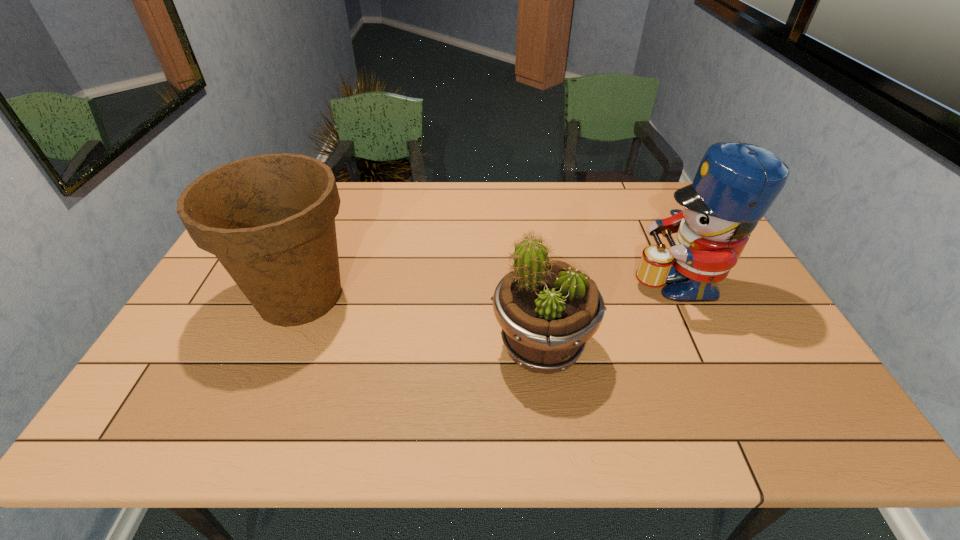
The width and height of the screenshot is (960, 540). Identify the location of empty location between the leftmost object and the second object from right to left. (420, 322).

You are a GUI agent. You are given a task and a screenshot of the screen. Output one action in this format:
    pyautogui.click(x=<x>, y=<y>)
    Task: Click on the vacant space in between the nutcracker and the leftmost object
    The height and width of the screenshot is (540, 960).
    Given the screenshot: What is the action you would take?
    (x=488, y=288)

Find the location of `vacant area that lies between the leftmost object and the nutcracker`. vacant area that lies between the leftmost object and the nutcracker is located at coordinates (488, 288).

This screenshot has width=960, height=540. Find the location of `vacant point located between the second object from left to right and the leftmost object`. vacant point located between the second object from left to right and the leftmost object is located at coordinates (420, 322).

Image resolution: width=960 pixels, height=540 pixels. What are the coordinates of `free spot between the second object from left to right and the tallest object` in the screenshot? It's located at (609, 313).

The width and height of the screenshot is (960, 540). I want to click on object identified as the second closest to the rightmost object, so click(x=269, y=219).

Identify the location of object identified as the second closest to the tallest object. The height and width of the screenshot is (540, 960). (269, 219).

Identify the location of free space that satisfies the following two spatial constraints: 1. on the front side of the left flowerpot; 2. on the left side of the second object from right to left. (278, 347).

At what (x,y) coordinates should I click in order to perform the action: click on vacant space that satisfies the following two spatial constraints: 1. on the front-facing side of the nutcracker; 2. on the front side of the left flowerpot. Please return your answer as a coordinate pair (x, y). Image resolution: width=960 pixels, height=540 pixels. Looking at the image, I should click on (683, 296).

At what (x,y) coordinates should I click in order to perform the action: click on vacant space that satisfies the following two spatial constraints: 1. on the front-facing side of the nutcracker; 2. on the front side of the right flowerpot. Please return your answer as a coordinate pair (x, y). Looking at the image, I should click on (707, 347).